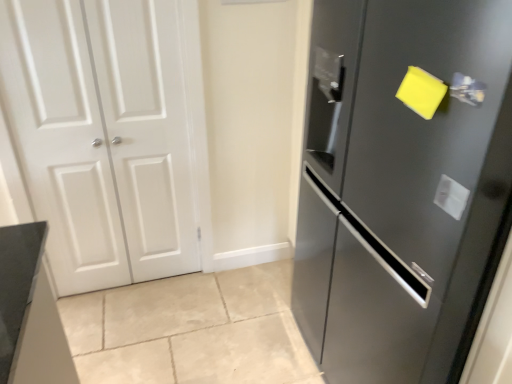
Question: From a real-world perspective, is white matte door at left, the 1th door from the left, physically located above or below satin black refrigerator at right, which ranks as the second door in left-to-right order?

Choices:
 (A) above
 (B) below

Answer: (B)

Question: From the image's perspective, is white matte door at left, the 1th door from the left, positioned above or below satin black refrigerator at right, which is counted as the 1th door, starting from the right?

Choices:
 (A) below
 (B) above

Answer: (B)

Question: Estimate the real-world distances between objects in this image. Which object is closer to the satin silver handle at upper right?

Choices:
 (A) white matte door at left, the 1th door from the left
 (B) satin black refrigerator at right, which ranks as the second door in left-to-right order

Answer: (B)

Question: Which of these objects is positioned farthest from the satin black refrigerator at right, which is counted as the 1th door, starting from the right?

Choices:
 (A) white matte door at left, the 1th door from the left
 (B) satin silver handle at upper right

Answer: (A)